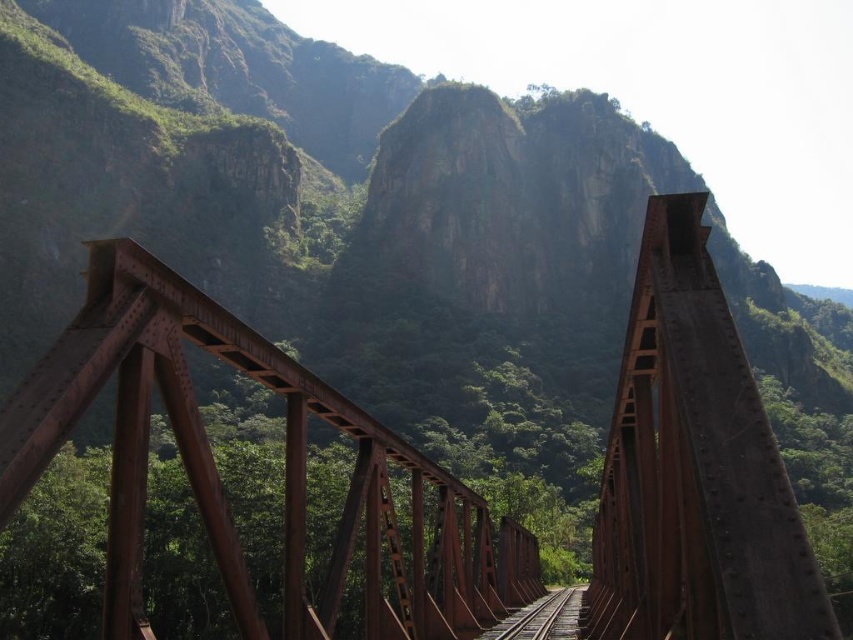
Does rusty metal train bridge at center have a lesser height compared to rusty metal train track at center?

In fact, rusty metal train bridge at center may be taller than rusty metal train track at center.

Does rusty metal train bridge at center lie in front of rusty metal train track at center?

Yes, rusty metal train bridge at center is in front of rusty metal train track at center.

What do you see at coordinates (218, 476) in the screenshot? The height and width of the screenshot is (640, 853). I see `rusty metal train bridge at center` at bounding box center [218, 476].

You are a GUI agent. You are given a task and a screenshot of the screen. Output one action in this format:
    pyautogui.click(x=<x>, y=<y>)
    Task: Click on the rusty metal train bridge at center
    
    Given the screenshot: What is the action you would take?
    pyautogui.click(x=218, y=476)